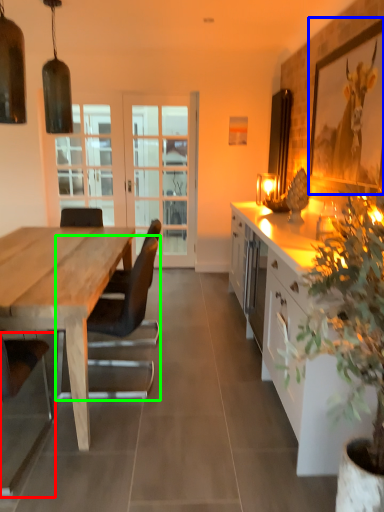
Question: Based on their relative distances, which object is nearer to chair (highlighted by a red box)? Choose from picture frame (highlighted by a blue box) and chair (highlighted by a green box).

Choices:
 (A) picture frame
 (B) chair

Answer: (B)